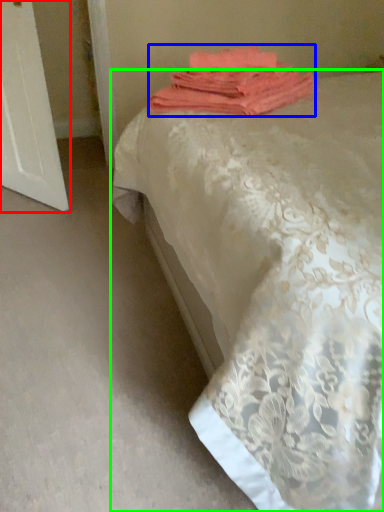
Question: Which object is the closest to the screen door (highlighted by a red box)? Choose among these: towel (highlighted by a blue box) or bed (highlighted by a green box).

Choices:
 (A) towel
 (B) bed

Answer: (A)